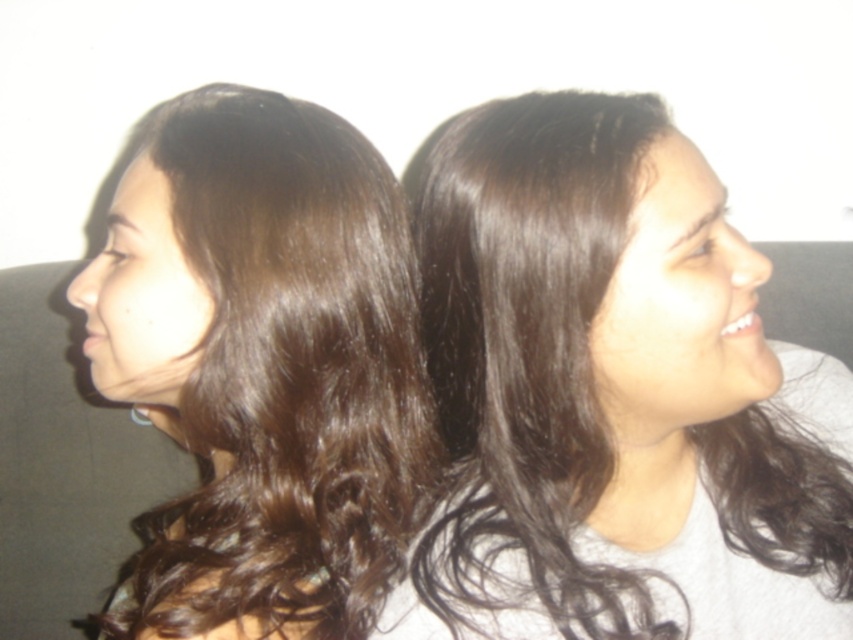
Question: Does dark brown hair at center appear over dark brown hair at left?

Choices:
 (A) no
 (B) yes

Answer: (B)

Question: Among these points, which one is farthest from the camera?

Choices:
 (A) (x=703, y=234)
 (B) (x=396, y=216)

Answer: (B)

Question: Does dark brown hair at center appear over dark brown hair at left?

Choices:
 (A) yes
 (B) no

Answer: (A)

Question: Can you confirm if dark brown hair at center is positioned to the right of dark brown hair at left?

Choices:
 (A) yes
 (B) no

Answer: (A)